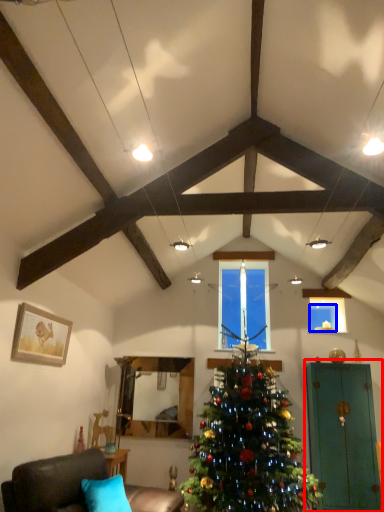
Question: Which point is further to the camera, armoire (highlighted by a red box) or window screen (highlighted by a blue box)?

Choices:
 (A) armoire
 (B) window screen

Answer: (B)